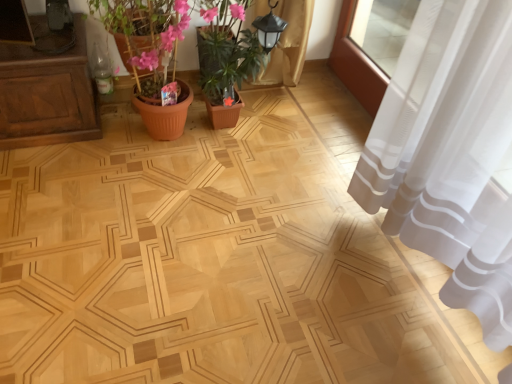
Describe the element at coordinates (150, 55) in the screenshot. I see `matte brown pot at left` at that location.

I want to click on matte brown pot at left, so click(150, 55).

At what (x,y) coordinates should I click in order to perform the action: click on matte brown pot at left. Please return your answer as a coordinate pair (x, y). Looking at the image, I should click on (150, 55).